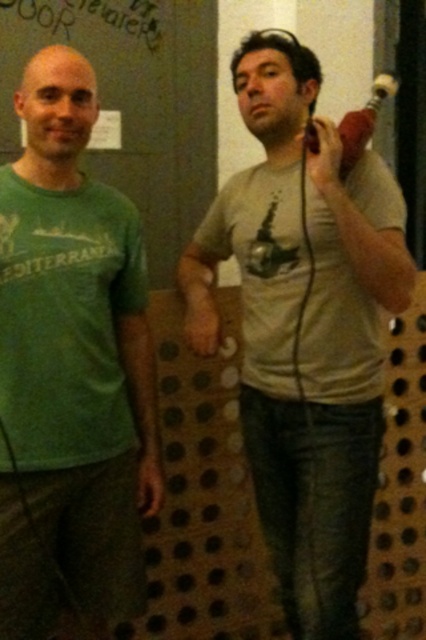
Who is higher up, gray matte t-shirt at center or green matte t-shirt at left?

gray matte t-shirt at center is above.

This screenshot has height=640, width=426. Describe the element at coordinates (305, 330) in the screenshot. I see `gray matte t-shirt at center` at that location.

Image resolution: width=426 pixels, height=640 pixels. I want to click on gray matte t-shirt at center, so click(x=305, y=330).

Which is below, gray matte t-shirt at center or wooden game controller at upper right?

gray matte t-shirt at center is below.

Is point (350, 189) farther from camera compared to point (365, 115)?

Yes, it is behind point (365, 115).

Who is more distant from viewer, (203, 230) or (370, 97)?

Point (370, 97)

Identify the location of gray matte t-shirt at center. This screenshot has height=640, width=426. (305, 330).

Is the position of green matte t-shirt at left more distant than that of wooden game controller at upper right?

No, it is in front of wooden game controller at upper right.

This screenshot has height=640, width=426. I want to click on green matte t-shirt at left, so click(x=71, y=371).

Locate an element on the screen. The image size is (426, 640). green matte t-shirt at left is located at coordinates (71, 371).